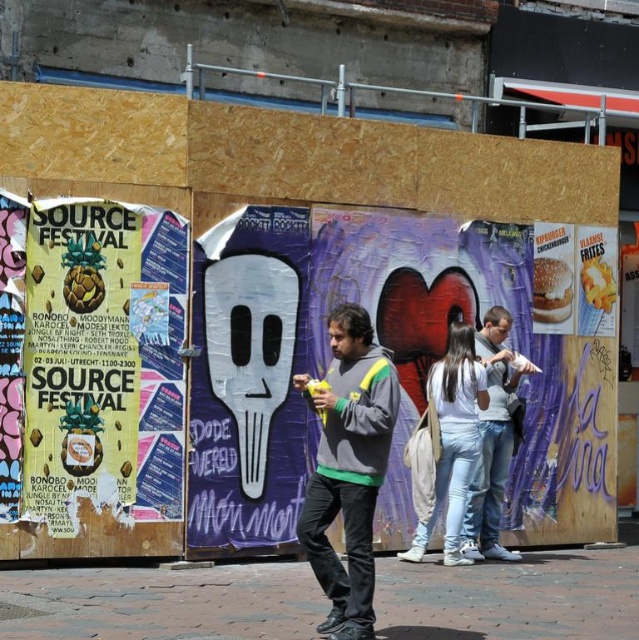
Is light blue jeans at center above white matte hoodie at center?

Actually, light blue jeans at center is below white matte hoodie at center.

Is light blue jeans at center positioned in front of white matte hoodie at center?

Yes, light blue jeans at center is in front of white matte hoodie at center.

Does point (404, 561) come in front of point (493, 513)?

Yes, it is in front of point (493, 513).

This screenshot has height=640, width=639. What are the coordinates of `light blue jeans at center` in the screenshot? It's located at (452, 438).

Who is higher up, gray fleece jacket at center or white matte hoodie at center?

gray fleece jacket at center

Does gray fleece jacket at center appear under white matte hoodie at center?

No.

Is point (367, 352) positioned behind point (509, 435)?

No, (367, 352) is closer to viewer.

The height and width of the screenshot is (640, 639). I want to click on gray fleece jacket at center, so click(x=348, y=467).

Who is lower down, yellow paper poster at left or gray fleece jacket at center?

Positioned lower is gray fleece jacket at center.

Is yellow paper poster at left positioned at the back of gray fleece jacket at center?

Yes, yellow paper poster at left is behind gray fleece jacket at center.

Is point (174, 413) positioned behind point (344, 637)?

Yes, point (174, 413) is behind point (344, 637).

The width and height of the screenshot is (639, 640). What are the coordinates of `yellow paper poster at left` in the screenshot? It's located at (93, 358).